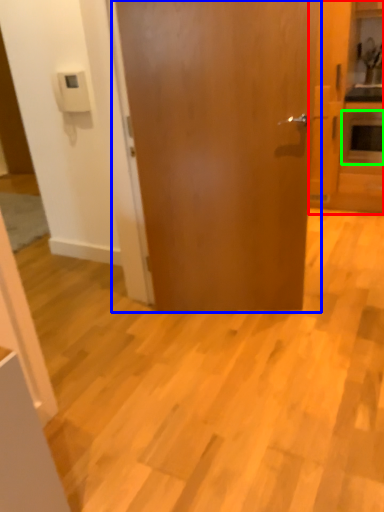
Question: Which object is the closest to the cabinetry (highlighted by a red box)? Choose among these: door (highlighted by a blue box) or appliance (highlighted by a green box).

Choices:
 (A) door
 (B) appliance

Answer: (B)